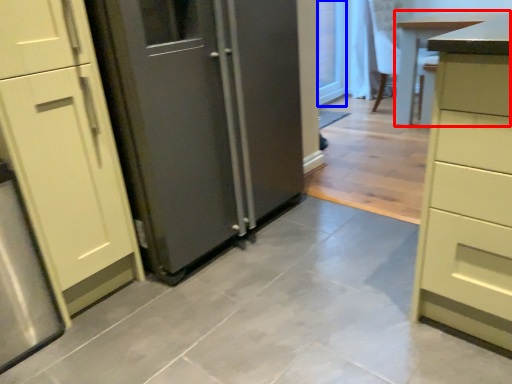
Question: Which object appears farthest to the camera in this image, table (highlighted by a red box) or glass door (highlighted by a blue box)?

Choices:
 (A) table
 (B) glass door

Answer: (B)